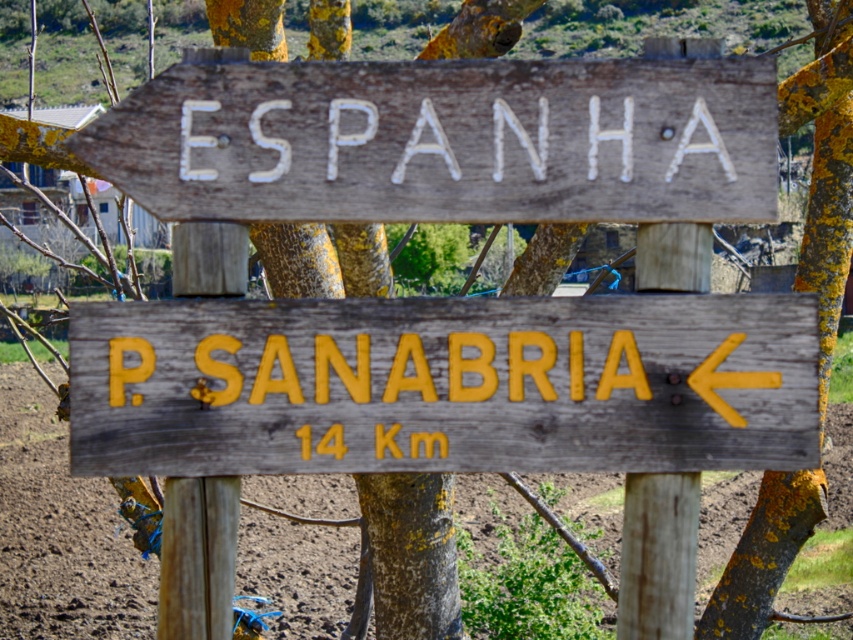
You are standing in front of the signpost and want to touch the point at coordinate point [556,92]. Can you reach it without moving closer?

The distance of point [556,92] is 3.55 meters away from you, so you cannot reach it without moving closer.

You are a traveler trying to read the signs on the signpost. The yellow painted wood sign at center and the wooden sign at upper center are both visible. Which one is wider?

The yellow painted wood sign at center is wider than the wooden sign at upper center.

Consider the image. You are a hiker trying to determine the distance to P. Sanabria. You see the yellow painted wood sign at center and the wooden sign at upper center. Which sign should you look at to find the distance information?

The wooden sign at upper center displays the distance to P. Sanabria, so you should look at the wooden sign at upper center.